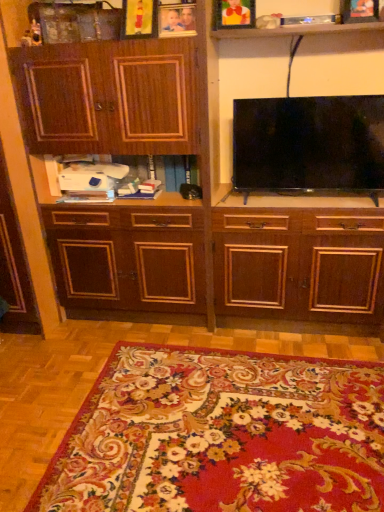
Locate an element on the screen. This screenshot has height=512, width=384. wooden picture frame at upper center, which is the 1th picture frame in left-to-right order is located at coordinates (139, 19).

What do you see at coordinates (221, 435) in the screenshot? This screenshot has height=512, width=384. I see `floral carpet at lower center` at bounding box center [221, 435].

The image size is (384, 512). I want to click on floral carpet at lower center, so click(x=221, y=435).

Describe the element at coordinates (234, 14) in the screenshot. I see `wooden picture frame at upper center, which appears as the 3th picture frame when viewed from the left` at that location.

How much space does wooden picture frame at upper center, the second picture frame in the right-to-left sequence, occupy vertically?

8.21 inches.

In the scene shown: Measure the distance between point (363, 134) and camera.

Point (363, 134) and camera are 6.16 feet apart from each other.

This screenshot has height=512, width=384. Find the location of `wooden picture frame at upper center, which is the 1th picture frame in left-to-right order`. wooden picture frame at upper center, which is the 1th picture frame in left-to-right order is located at coordinates (139, 19).

Can you tell me how much wooden photo frame at upper center, marked as the second picture frame in a left-to-right arrangement, and black glossy flat-screen tv at upper center differ in facing direction?

The angle between the facing direction of wooden photo frame at upper center, marked as the second picture frame in a left-to-right arrangement, and the facing direction of black glossy flat-screen tv at upper center is 8 degrees.

Between wooden photo frame at upper center, the third picture frame viewed from the right, and black glossy flat-screen tv at upper center, which one appears on the left side from the viewer's perspective?

From the viewer's perspective, wooden photo frame at upper center, the third picture frame viewed from the right, appears more on the left side.

Are dark wood cabinet at center and white plastic printer at center beside each other?

They are not placed beside each other.

Which of these two, dark wood cabinet at center or white plastic printer at center, stands shorter?

With less height is white plastic printer at center.

Is dark wood cabinet at center aimed at white plastic printer at center?

Yes, dark wood cabinet at center is oriented towards white plastic printer at center.

From a real-world perspective, does dark wood cabinet at center sit lower than white plastic printer at center?

No, from a real-world perspective, dark wood cabinet at center is not below white plastic printer at center.

From the picture: From a real-world perspective, is wooden picture frame at upper center, positioned as the 4th picture frame in right-to-left order, above or below floral carpet at lower center?

wooden picture frame at upper center, positioned as the 4th picture frame in right-to-left order, is above floral carpet at lower center.

Can you confirm if wooden picture frame at upper center, positioned as the 4th picture frame in right-to-left order, is taller than floral carpet at lower center?

Yes, wooden picture frame at upper center, positioned as the 4th picture frame in right-to-left order, is taller than floral carpet at lower center.

Is floral carpet at lower center inside wooden picture frame at upper center, positioned as the 4th picture frame in right-to-left order?

Definitely not — floral carpet at lower center is not inside wooden picture frame at upper center, positioned as the 4th picture frame in right-to-left order.

How many degrees apart are the facing directions of wooden picture frame at upper center, positioned as the 4th picture frame in right-to-left order, and floral carpet at lower center?

wooden picture frame at upper center, positioned as the 4th picture frame in right-to-left order, and floral carpet at lower center are facing 85.6 degrees away from each other.

Looking at this image, do you think floral carpet at lower center is within white plastic printer at center, or outside of it?

floral carpet at lower center exists outside the volume of white plastic printer at center.

Where is `mat that is below the white plastic printer at center (from the image's perspective)`? The height and width of the screenshot is (512, 384). mat that is below the white plastic printer at center (from the image's perspective) is located at coordinates (221, 435).

Considering the relative positions of floral carpet at lower center and white plastic printer at center in the image provided, is floral carpet at lower center to the left of white plastic printer at center from the viewer's perspective?

Incorrect, floral carpet at lower center is not on the left side of white plastic printer at center.

Which object is thinner, floral carpet at lower center or white plastic printer at center?

white plastic printer at center.

Considering the relative positions of floral carpet at lower center and wooden picture frame at upper center, which appears as the 3th picture frame when viewed from the left, in the image provided, is floral carpet at lower center behind wooden picture frame at upper center, which appears as the 3th picture frame when viewed from the left,?

That is False.

In the scene shown: Is floral carpet at lower center spatially inside wooden picture frame at upper center, the second picture frame in the right-to-left sequence, or outside of it?

floral carpet at lower center cannot be found inside wooden picture frame at upper center, the second picture frame in the right-to-left sequence.

From the picture: Who is taller, floral carpet at lower center or wooden picture frame at upper center, which appears as the 3th picture frame when viewed from the left?

wooden picture frame at upper center, which appears as the 3th picture frame when viewed from the left.

Measure the distance from floral carpet at lower center to wooden picture frame at upper center, which appears as the 3th picture frame when viewed from the left.

A distance of 1.71 meters exists between floral carpet at lower center and wooden picture frame at upper center, which appears as the 3th picture frame when viewed from the left.

Is wooden picture frame at upper right, the 1th picture frame positioned from the right, closer to the viewer compared to wooden photo frame at upper center, the third picture frame viewed from the right?

Yes, it is in front of wooden photo frame at upper center, the third picture frame viewed from the right.

Between point (344, 15) and point (194, 18), which one is positioned behind?

The point (344, 15) is farther.

Considering the sizes of objects wooden picture frame at upper right, the 1th picture frame positioned from the right, and wooden photo frame at upper center, the third picture frame viewed from the right, in the image provided, who is taller, wooden picture frame at upper right, the 1th picture frame positioned from the right, or wooden photo frame at upper center, the third picture frame viewed from the right,?

wooden picture frame at upper right, the 1th picture frame positioned from the right, is taller.

How different are the orientations of wooden picture frame at upper right, the 1th picture frame positioned from the right, and wooden picture frame at upper center, positioned as the 4th picture frame in right-to-left order, in degrees?

3.31 degrees.

From the image's perspective, is wooden picture frame at upper right, positioned as the fourth picture frame in left-to-right order, under wooden picture frame at upper center, positioned as the 4th picture frame in right-to-left order?

Yes, from the image's perspective, wooden picture frame at upper right, positioned as the fourth picture frame in left-to-right order, is beneath wooden picture frame at upper center, positioned as the 4th picture frame in right-to-left order.

Would you consider wooden picture frame at upper right, the 1th picture frame positioned from the right, to be distant from wooden picture frame at upper center, which is the 1th picture frame in left-to-right order?

No, wooden picture frame at upper right, the 1th picture frame positioned from the right, is not far away from wooden picture frame at upper center, which is the 1th picture frame in left-to-right order.

From the picture: Considering the relative sizes of wooden picture frame at upper right, the 1th picture frame positioned from the right, and wooden picture frame at upper center, positioned as the 4th picture frame in right-to-left order, in the image provided, is wooden picture frame at upper right, the 1th picture frame positioned from the right, shorter than wooden picture frame at upper center, positioned as the 4th picture frame in right-to-left order,?

Yes, wooden picture frame at upper right, the 1th picture frame positioned from the right, is shorter than wooden picture frame at upper center, positioned as the 4th picture frame in right-to-left order.

The height and width of the screenshot is (512, 384). I want to click on the 1st picture frame positioned above the black glossy flat-screen tv at upper center (from the image's perspective), so click(x=176, y=20).

This screenshot has height=512, width=384. I want to click on cabinetry in front of the white plastic printer at center, so click(x=182, y=200).

Looking at this image, considering their positions, is black glossy flat-screen tv at upper center positioned closer to white plastic printer at center than wooden photo frame at upper center, the third picture frame viewed from the right?

wooden photo frame at upper center, the third picture frame viewed from the right, lies closer to white plastic printer at center than the other object.

Considering their positions, is wooden picture frame at upper center, the second picture frame in the right-to-left sequence, positioned further to black glossy flat-screen tv at upper center than wooden picture frame at upper right, positioned as the fourth picture frame in left-to-right order?

wooden picture frame at upper center, the second picture frame in the right-to-left sequence.

When comparing their distances from floral carpet at lower center, does wooden picture frame at upper right, the 1th picture frame positioned from the right, or black glossy flat-screen tv at upper center seem closer?

Based on the image, black glossy flat-screen tv at upper center appears to be nearer to floral carpet at lower center.

Based on their spatial positions, is wooden picture frame at upper center, positioned as the 4th picture frame in right-to-left order, or dark wood cabinet at center further from floral carpet at lower center?

wooden picture frame at upper center, positioned as the 4th picture frame in right-to-left order, is further to floral carpet at lower center.

When comparing their distances from wooden picture frame at upper center, the second picture frame in the right-to-left sequence, does black glossy flat-screen tv at upper center or white plastic printer at center seem closer?

black glossy flat-screen tv at upper center is positioned closer to the anchor wooden picture frame at upper center, the second picture frame in the right-to-left sequence.

Considering their positions, is wooden photo frame at upper center, the third picture frame viewed from the right, positioned closer to wooden picture frame at upper right, the 1th picture frame positioned from the right, than wooden picture frame at upper center, which appears as the 3th picture frame when viewed from the left?

The object closer to wooden picture frame at upper right, the 1th picture frame positioned from the right, is wooden picture frame at upper center, which appears as the 3th picture frame when viewed from the left.

Estimate the real-world distances between objects in this image. Which object is closer to floral carpet at lower center, black glossy flat-screen tv at upper center or wooden picture frame at upper right, positioned as the fourth picture frame in left-to-right order?

black glossy flat-screen tv at upper center.

Looking at this image, estimate the real-world distances between objects in this image. Which object is further from wooden picture frame at upper center, which is the 1th picture frame in left-to-right order, wooden picture frame at upper right, positioned as the fourth picture frame in left-to-right order, or black glossy flat-screen tv at upper center?

Based on the image, wooden picture frame at upper right, positioned as the fourth picture frame in left-to-right order, appears to be further to wooden picture frame at upper center, which is the 1th picture frame in left-to-right order.

The height and width of the screenshot is (512, 384). In order to click on cabinetry between black glossy flat-screen tv at upper center and floral carpet at lower center from top to bottom in this screenshot , I will do `click(182, 200)`.

Identify the location of cabinetry situated between wooden photo frame at upper center, marked as the second picture frame in a left-to-right arrangement, and wooden picture frame at upper right, positioned as the fourth picture frame in left-to-right order, from left to right. Image resolution: width=384 pixels, height=512 pixels. (182, 200).

The width and height of the screenshot is (384, 512). I want to click on shelf between wooden picture frame at upper center, which appears as the 3th picture frame when viewed from the left, and floral carpet at lower center in the up-down direction, so click(x=45, y=177).

Image resolution: width=384 pixels, height=512 pixels. Identify the location of shelf between wooden picture frame at upper center, positioned as the 4th picture frame in right-to-left order, and floral carpet at lower center from top to bottom. (45, 177).